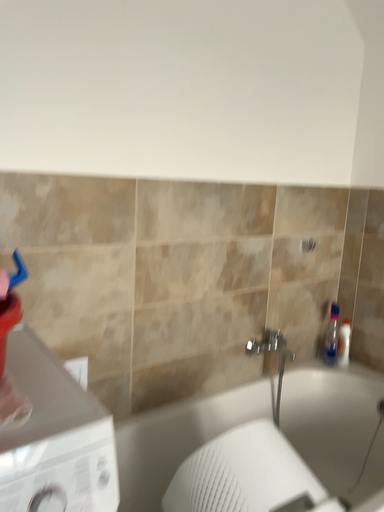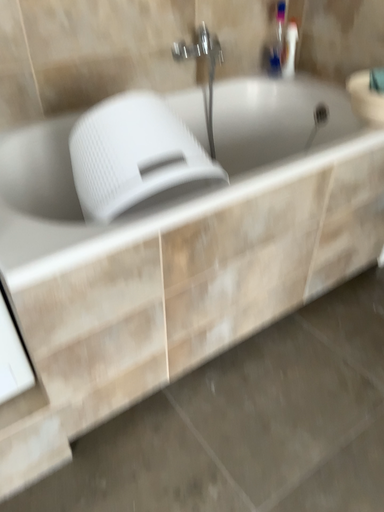
Question: How did the camera likely rotate when shooting the video?

Choices:
 (A) rotated downward
 (B) rotated upward

Answer: (A)